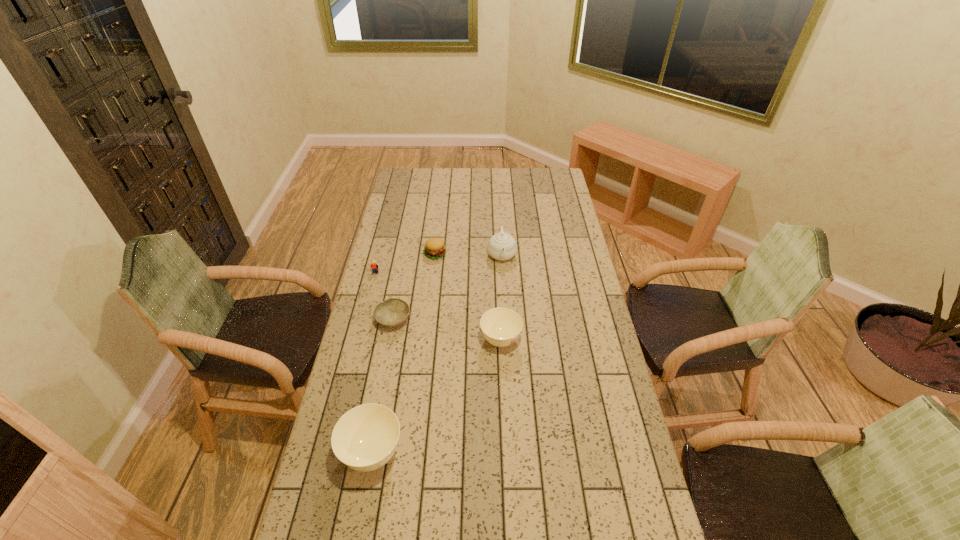
Observe the arrangement of all sugar bowls in the image. To keep them evenly spaced, where would you place another sugar bowl on the right? Please locate a free space. Please provide its 2D coordinates. Your answer should be formatted as a tuple, i.e. [(x, y)], where the tuple contains the x and y coordinates of a point satisfying the conditions above.

[(588, 264)]